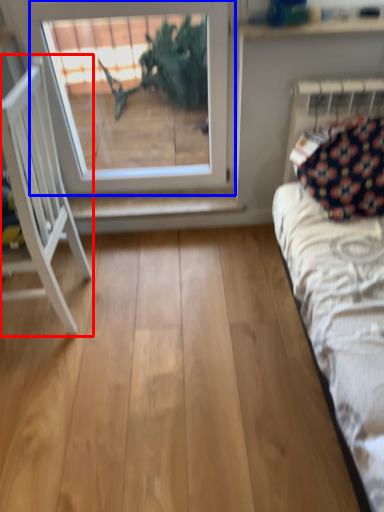
Question: Which object appears closest to the camera in this image, furniture (highlighted by a red box) or window (highlighted by a blue box)?

Choices:
 (A) furniture
 (B) window

Answer: (A)